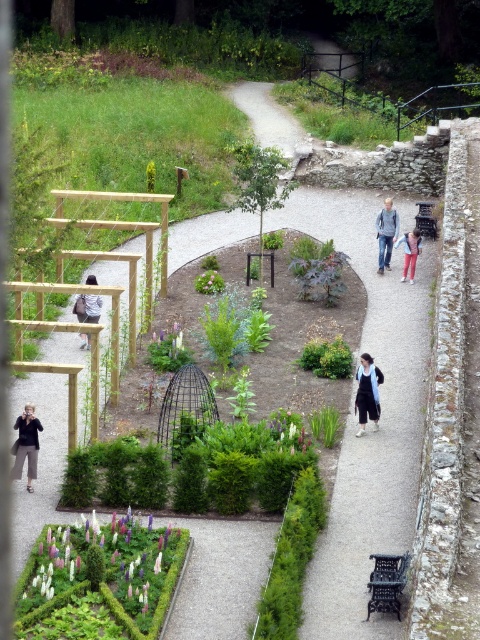
Question: Which of the following is the closest to the observer?

Choices:
 (A) (85, 333)
 (B) (313, 369)
 (C) (415, 260)

Answer: (B)

Question: Which point appears closest to the camera in this image?

Choices:
 (A) (167, 580)
 (B) (29, 442)
 (C) (197, 275)

Answer: (A)

Question: Does dark gray pants at lower left have a greater width compared to pink fabric dress at center-right?

Choices:
 (A) yes
 (B) no

Answer: (B)

Question: Is green leafy bush at lower left thinner than matte black backpack at left?

Choices:
 (A) yes
 (B) no

Answer: (B)

Question: Which point is farther to the camera?

Choices:
 (A) dark gray pants at lower left
 (B) green leafy bush at lower left

Answer: (A)

Question: Does dark blue fabric dress at center appear under matte black backpack at left?

Choices:
 (A) no
 (B) yes

Answer: (B)